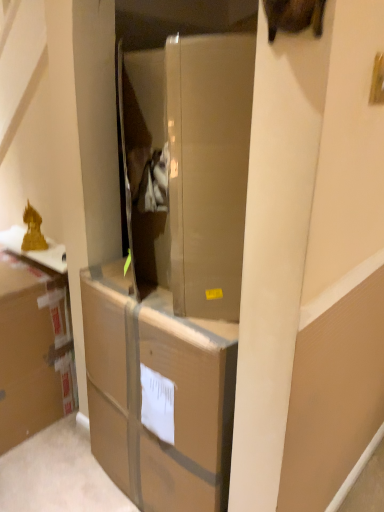
Question: From a real-world perspective, is brown cardboard box at left above or below brown cardboard box at center?

Choices:
 (A) above
 (B) below

Answer: (B)

Question: Looking at their shapes, would you say brown cardboard box at left is wider or thinner than brown cardboard box at center?

Choices:
 (A) thin
 (B) wide

Answer: (A)

Question: Is brown cardboard box at left in front of or behind brown cardboard box at center in the image?

Choices:
 (A) front
 (B) behind

Answer: (B)

Question: Would you say brown cardboard box at center is inside or outside brown cardboard box at left?

Choices:
 (A) inside
 (B) outside

Answer: (B)

Question: In the image, is brown cardboard box at center positioned in front of or behind brown cardboard box at left?

Choices:
 (A) front
 (B) behind

Answer: (A)

Question: Is point (94, 281) positioned closer to the camera than point (39, 320)?

Choices:
 (A) closer
 (B) farther

Answer: (A)

Question: In terms of width, does brown cardboard box at center look wider or thinner when compared to brown cardboard box at left?

Choices:
 (A) thin
 (B) wide

Answer: (B)